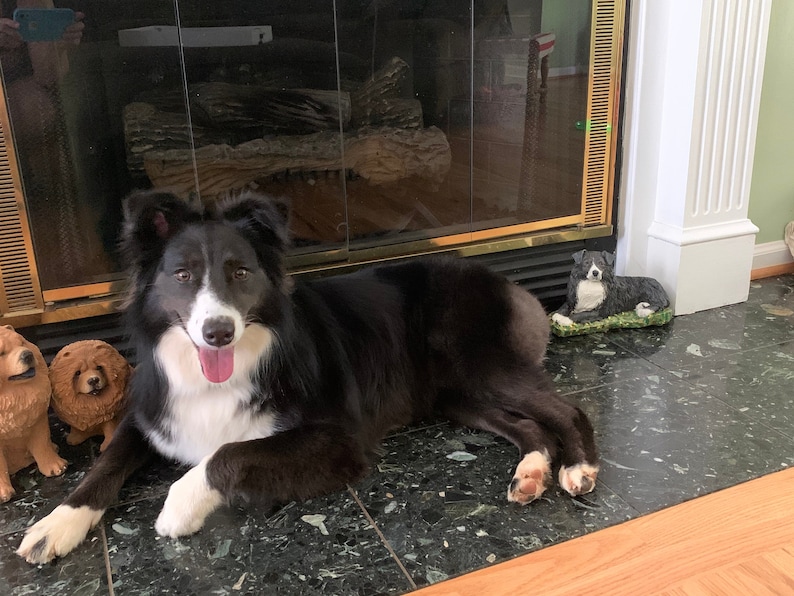
Image resolution: width=794 pixels, height=596 pixels. I want to click on light green wall, so click(x=766, y=145).